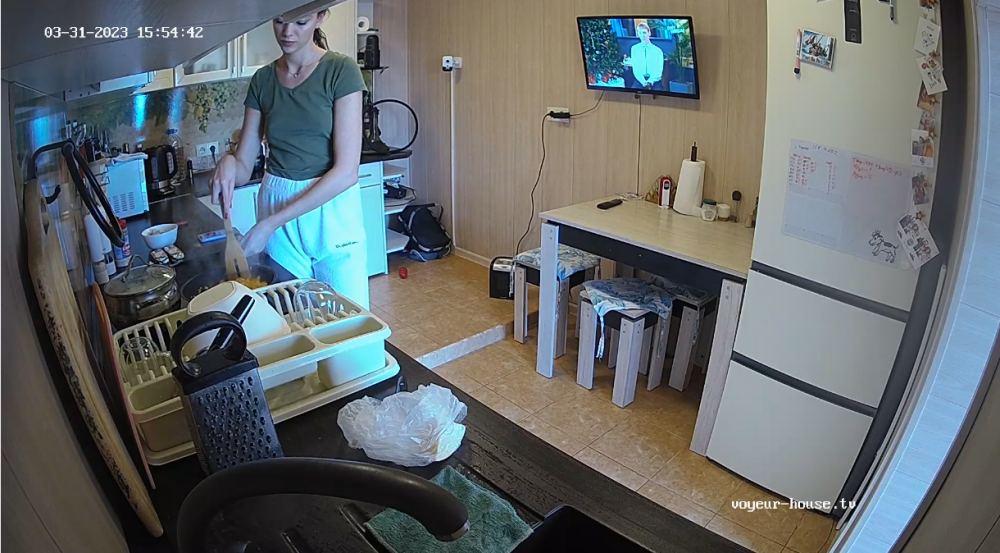
What are the coordinates of `tv that nobody is watching` in the screenshot? It's located at pos(641,53).